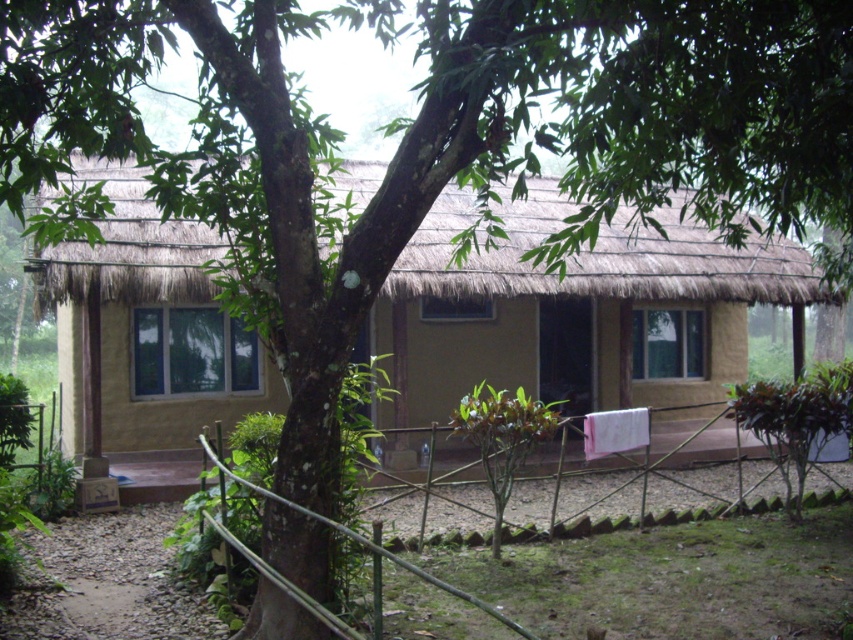
Question: Can you confirm if beige clay hut at center is positioned to the left of bamboo fence at lower center?

Choices:
 (A) yes
 (B) no

Answer: (A)

Question: Is beige clay hut at center wider than bamboo fence at lower center?

Choices:
 (A) no
 (B) yes

Answer: (B)

Question: Which point appears closest to the camera in this image?

Choices:
 (A) [x=390, y=552]
 (B) [x=149, y=339]

Answer: (A)

Question: Can you confirm if beige clay hut at center is positioned to the right of bamboo fence at lower center?

Choices:
 (A) yes
 (B) no

Answer: (B)

Question: Which point is farther to the camera?

Choices:
 (A) bamboo fence at lower center
 (B) beige clay hut at center

Answer: (B)